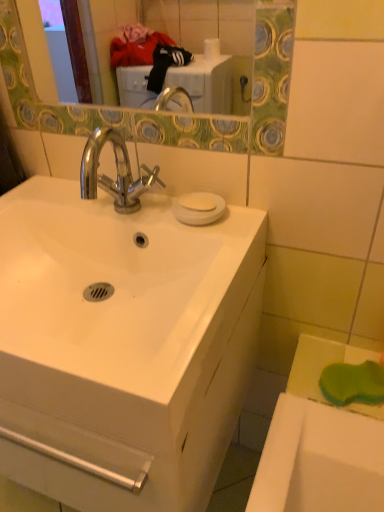
You are a GUI agent. You are given a task and a screenshot of the screen. Output one action in this format:
    pyautogui.click(x=<x>, y=<y>)
    Task: Click on the white glossy cabinet at center
    This screenshot has height=512, width=384.
    Given the screenshot: What is the action you would take?
    pyautogui.click(x=137, y=449)

Measure the distance between point (188, 199) and camera.

Point (188, 199) is 34.45 inches from camera.

Identify the location of white matte soap at upper center. This screenshot has width=384, height=512. (198, 201).

Image resolution: width=384 pixels, height=512 pixels. Describe the element at coordinates (112, 280) in the screenshot. I see `white glossy sink at center` at that location.

Where is `white glossy sink at center`? white glossy sink at center is located at coordinates coord(112,280).

At what (x,y) coordinates should I click in order to perform the action: click on white glossy cabinet at center. Please return your answer as a coordinate pair (x, y). Image resolution: width=384 pixels, height=512 pixels. Looking at the image, I should click on (137, 449).

From a real-world perspective, does white glossy cabinet at center sit lower than white glossy sink at center?

Yes.

Is white glossy sink at center completely or partially inside white glossy cabinet at center?

No, white glossy sink at center is located outside of white glossy cabinet at center.

Consider the image. How different are the orientations of white glossy cabinet at center and white glossy sink at center in degrees?

They differ by 1.09e-05 degrees in their facing directions.

Is the surface of white glossy cabinet at center in direct contact with white glossy sink at center?

No, white glossy cabinet at center is not making contact with white glossy sink at center.

The width and height of the screenshot is (384, 512). Identify the location of sink that is in front of the white matte soap at upper center. (112, 280).

Does white glossy sink at center have a greater height compared to white matte soap at upper center?

Yes, white glossy sink at center is taller than white matte soap at upper center.

Is white glossy sink at center to the left or to the right of white matte soap at upper center in the image?

From the image, it's evident that white glossy sink at center is to the left of white matte soap at upper center.

Is white glossy sink at center facing towards white matte soap at upper center?

No, white glossy sink at center is not facing towards white matte soap at upper center.

How many degrees apart are the facing directions of white glossy sink at center and white glossy cabinet at center?

1.09e-05 degrees.

From a real-world perspective, which object stands above the other?

white glossy sink at center, from a real-world perspective.

Considering the relative sizes of white glossy sink at center and white glossy cabinet at center in the image provided, is white glossy sink at center thinner than white glossy cabinet at center?

In fact, white glossy sink at center might be wider than white glossy cabinet at center.

Is white glossy sink at center positioned with its back to white glossy cabinet at center?

No, white glossy cabinet at center is not at the back of white glossy sink at center.

Is white matte soap at upper center smaller than white glossy cabinet at center?

Yes.

Which object is more forward, white matte soap at upper center or white glossy cabinet at center?

Positioned in front is white glossy cabinet at center.

Between white matte soap at upper center and white glossy cabinet at center, which one appears on the left side from the viewer's perspective?

From the viewer's perspective, white glossy cabinet at center appears more on the left side.

Based on the photo, from the image's perspective, would you say white matte soap at upper center is positioned over white glossy cabinet at center?

Yes.

Is the position of white matte soap at upper center less distant than that of white glossy sink at center?

No, it is not.

Identify the location of soap above the white glossy sink at center (from a real-world perspective). Image resolution: width=384 pixels, height=512 pixels. (198, 201).

Is white matte soap at upper center at the left side of white glossy sink at center?

No, white matte soap at upper center is not to the left of white glossy sink at center.

Locate an element on the screen. soap on the right side of white glossy cabinet at center is located at coordinates (198, 201).

From a real-world perspective, is white glossy cabinet at center positioned over white matte soap at upper center based on gravity?

No, from a real-world perspective, white glossy cabinet at center is not above white matte soap at upper center.

Does white glossy cabinet at center turn towards white matte soap at upper center?

No, white glossy cabinet at center does not turn towards white matte soap at upper center.

At what (x,y) coordinates should I click in order to perform the action: click on bathroom cabinet on the left of white glossy sink at center. Please return your answer as a coordinate pair (x, y). Image resolution: width=384 pixels, height=512 pixels. Looking at the image, I should click on (137, 449).

Locate an element on the screen. The width and height of the screenshot is (384, 512). soap located above the white glossy sink at center (from a real-world perspective) is located at coordinates (198, 201).

When comparing their distances from white matte soap at upper center, does white glossy cabinet at center or white glossy sink at center seem closer?

The object closer to white matte soap at upper center is white glossy sink at center.

Estimate the real-world distances between objects in this image. Which object is closer to white glossy sink at center, white glossy cabinet at center or white matte soap at upper center?

white glossy cabinet at center lies closer to white glossy sink at center than the other object.

Looking at the image, which one is located further to white glossy cabinet at center, white matte soap at upper center or white glossy sink at center?

white matte soap at upper center is positioned further to the anchor white glossy cabinet at center.

Based on their spatial positions, is white matte soap at upper center or white glossy cabinet at center closer to white glossy sink at center?

white glossy cabinet at center.

From the image, which object appears to be farther from white glossy cabinet at center, white glossy sink at center or white matte soap at upper center?

white matte soap at upper center lies further to white glossy cabinet at center than the other object.

From the image, which object appears to be nearer to white matte soap at upper center, white glossy sink at center or white glossy cabinet at center?

white glossy sink at center.

Locate an element on the screen. The height and width of the screenshot is (512, 384). sink between white matte soap at upper center and white glossy cabinet at center in the up-down direction is located at coordinates (112, 280).